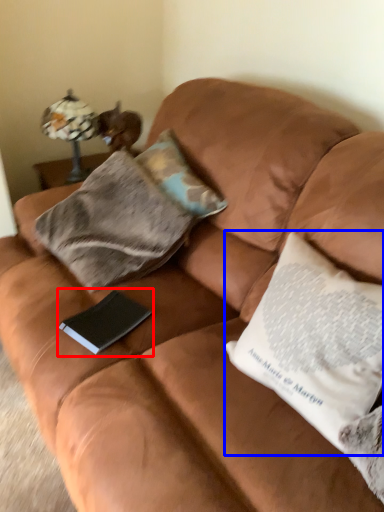
Question: Which of the following is the farthest to the observer, paperback book (highlighted by a red box) or pillow (highlighted by a blue box)?

Choices:
 (A) paperback book
 (B) pillow

Answer: (A)